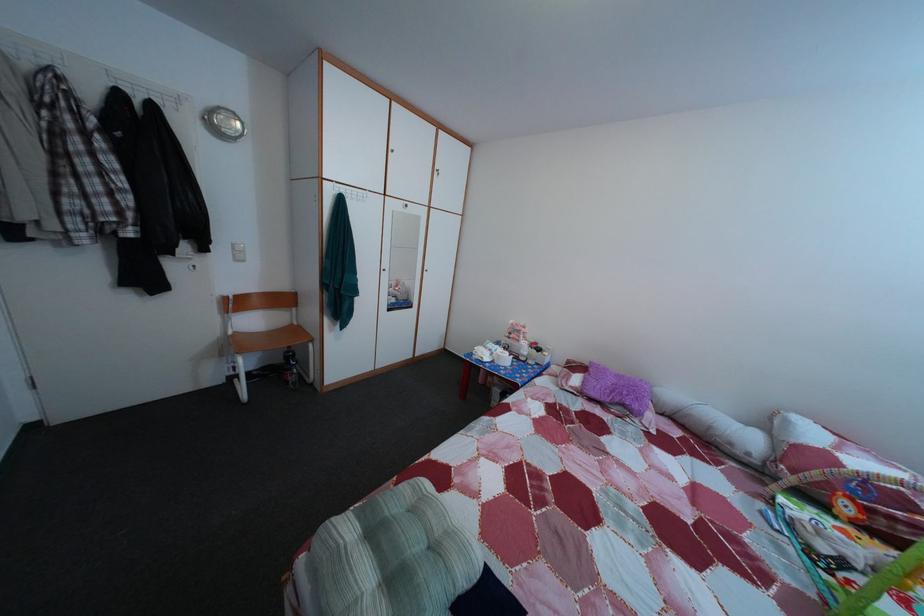
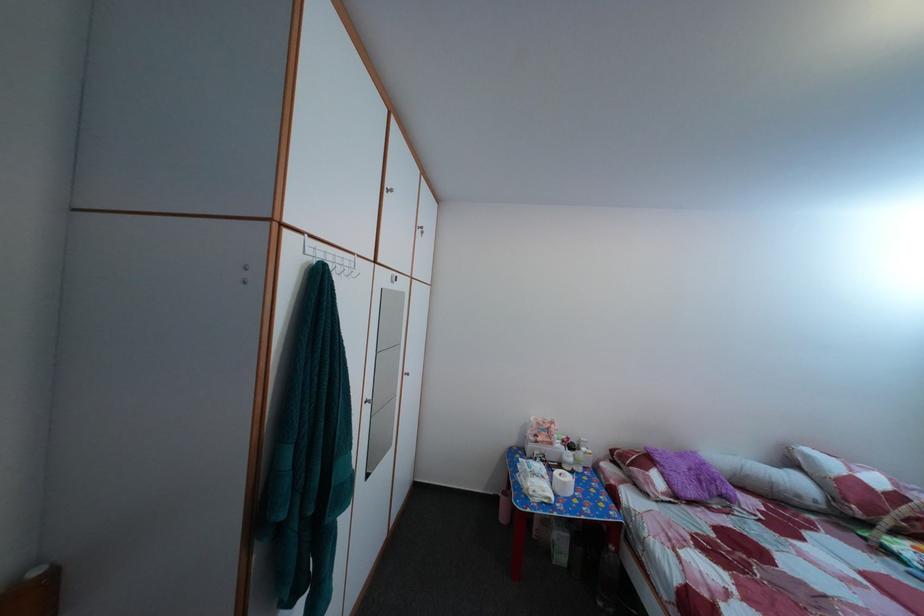
The point at (544, 351) is marked in the first image. Where is the corresponding point in the second image?

(578, 447)